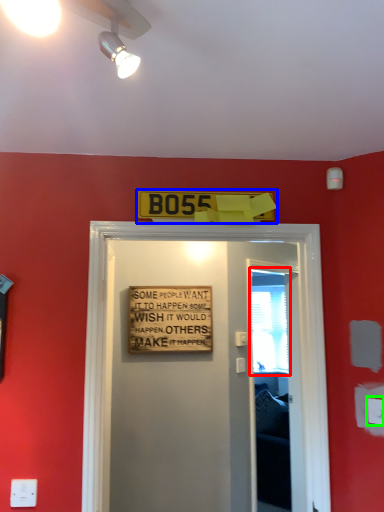
Question: Estimate the real-world distances between objects in this image. Which object is farther from window screen (highlighted by a red box), warning sign (highlighted by a blue box) or electric outlet (highlighted by a green box)?

Choices:
 (A) warning sign
 (B) electric outlet

Answer: (B)